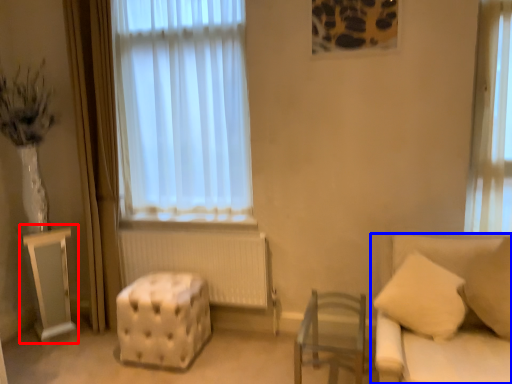
Question: Which point is closer to the camera, table (highlighted by a red box) or studio couch (highlighted by a blue box)?

Choices:
 (A) table
 (B) studio couch

Answer: (B)